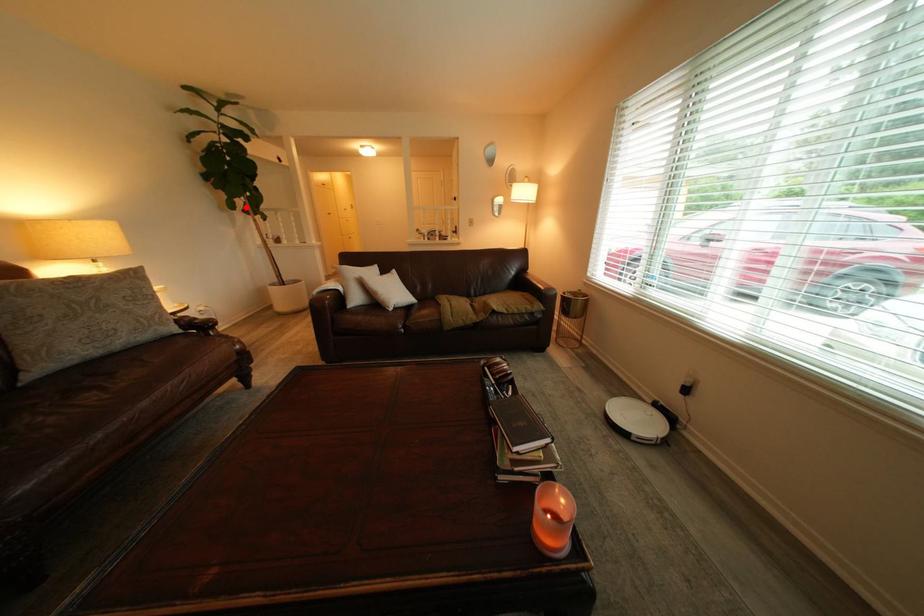
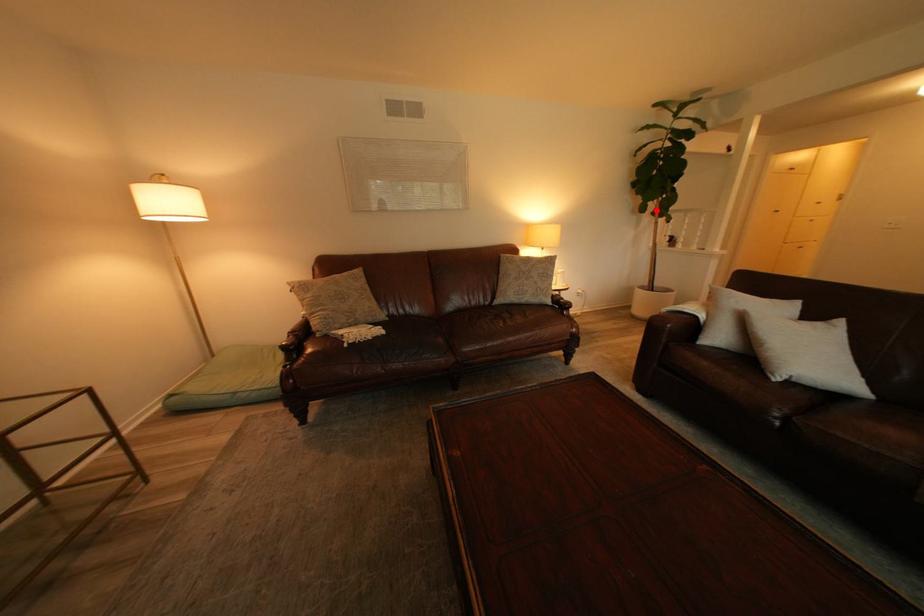
I am providing you with two images of the same scene from different viewpoints. A red point is marked on the first image and another point is marked on the second image. Does the point marked in image1 correspond to the same location as the one in image2?

Yes